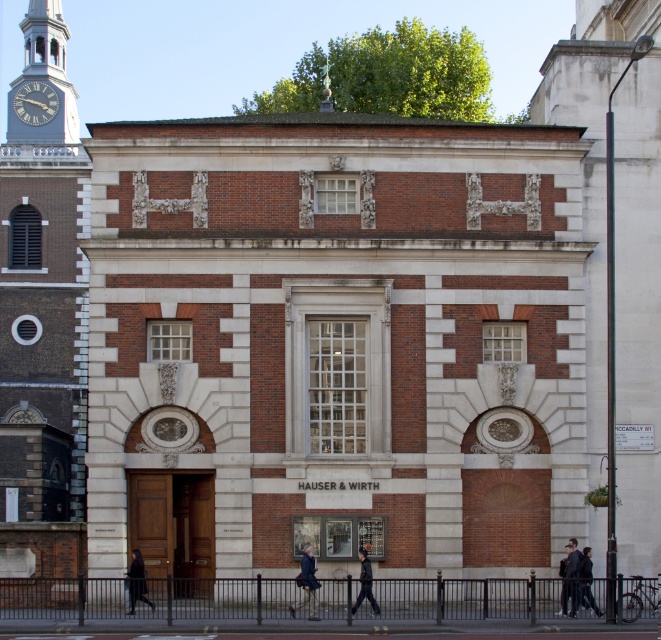
Does blue painted wood clock at upper left appear under dark blue jacket at lower right?

No, blue painted wood clock at upper left is not below dark blue jacket at lower right.

Does blue painted wood clock at upper left have a larger size compared to dark blue jacket at lower right?

Actually, blue painted wood clock at upper left might be smaller than dark blue jacket at lower right.

Does point (48, 113) lie in front of point (598, 611)?

No.

Locate an element on the screen. The image size is (661, 640). blue painted wood clock at upper left is located at coordinates (34, 102).

Who is positioned more to the right, dark gray jacket at center or dark brown leather coat at lower center?

dark gray jacket at center

Who is more distant from viewer, (570, 612) or (128, 573)?

Positioned behind is point (128, 573).

Is point (566, 557) farther from viewer compared to point (132, 595)?

Yes, it is behind point (132, 595).

Find the location of `dark gray jacket at center`. dark gray jacket at center is located at coordinates (568, 577).

Does dark brown leather coat at lower center lie behind black leather jacket at center?

That is True.

At what (x,y) coordinates should I click in order to perform the action: click on dark brown leather coat at lower center. Please return your answer as a coordinate pair (x, y). The width and height of the screenshot is (661, 640). Looking at the image, I should click on (136, 580).